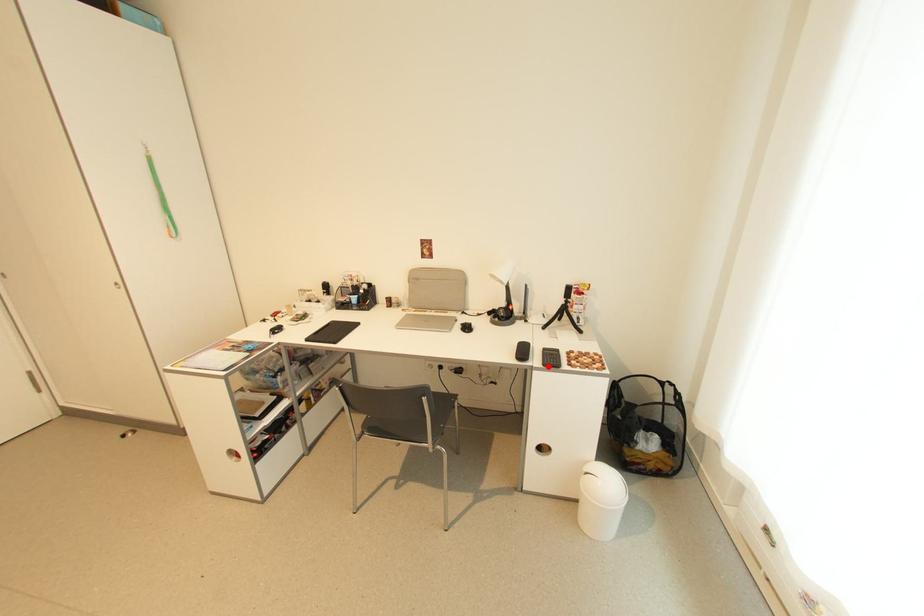
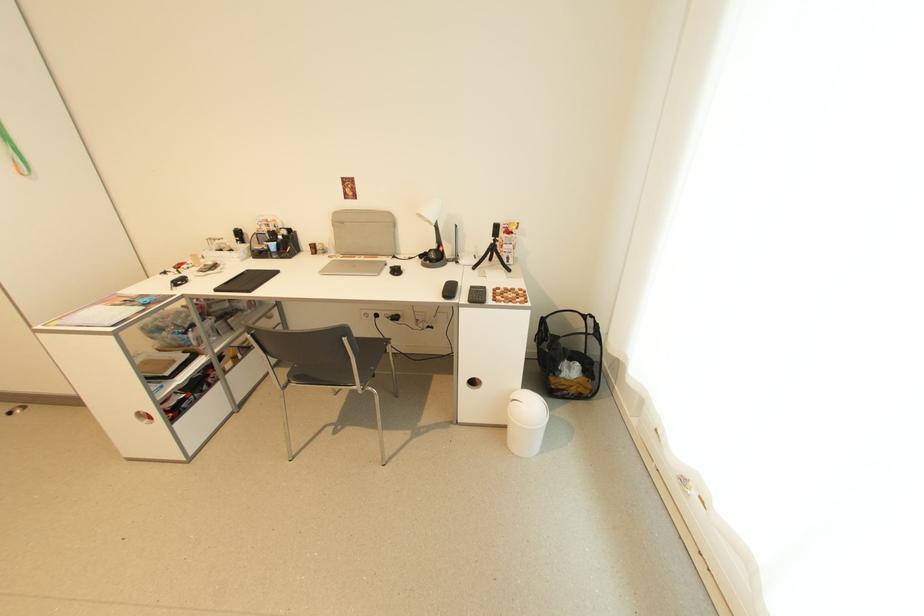
Question: I am providing you with two images of the same scene from different viewpoints. A red point is marked on the first image. Can you still see the location of the red point in image 2?

Choices:
 (A) Yes
 (B) No

Answer: (A)